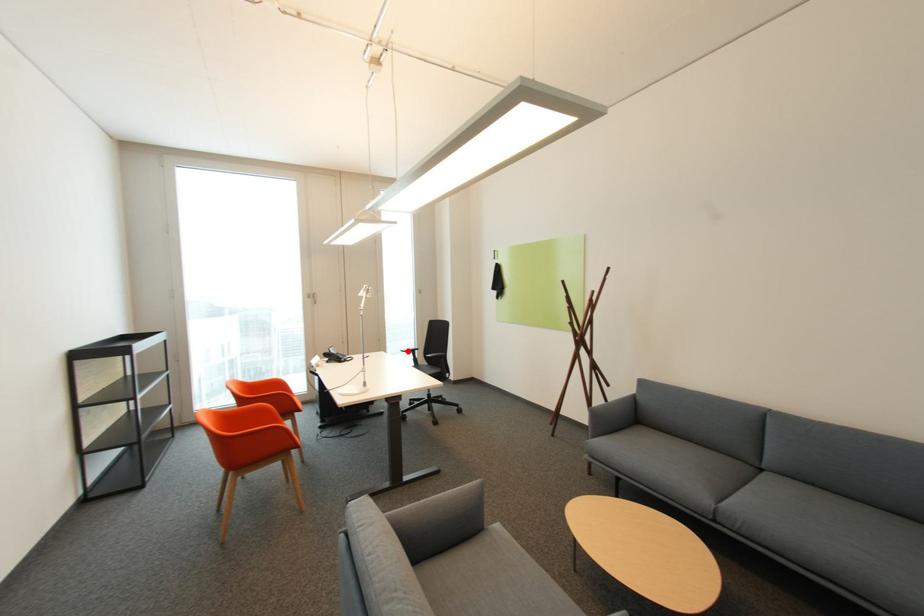
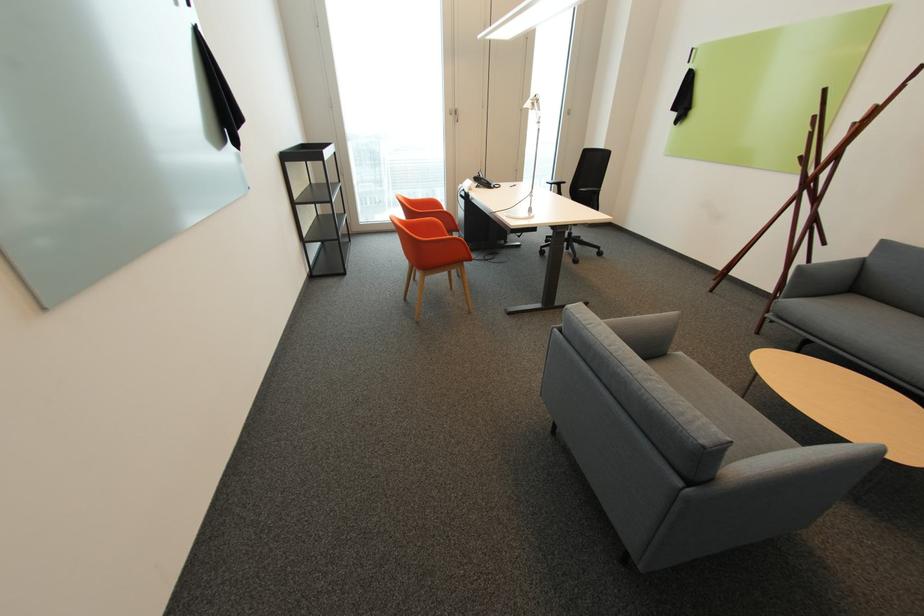
Question: I am providing you with two images of the same scene from different viewpoints. A red point is shown in image1. For the corresponding object point in image2, is it positioned nearer or farther from the camera?

Choices:
 (A) Nearer
 (B) Farther

Answer: (B)